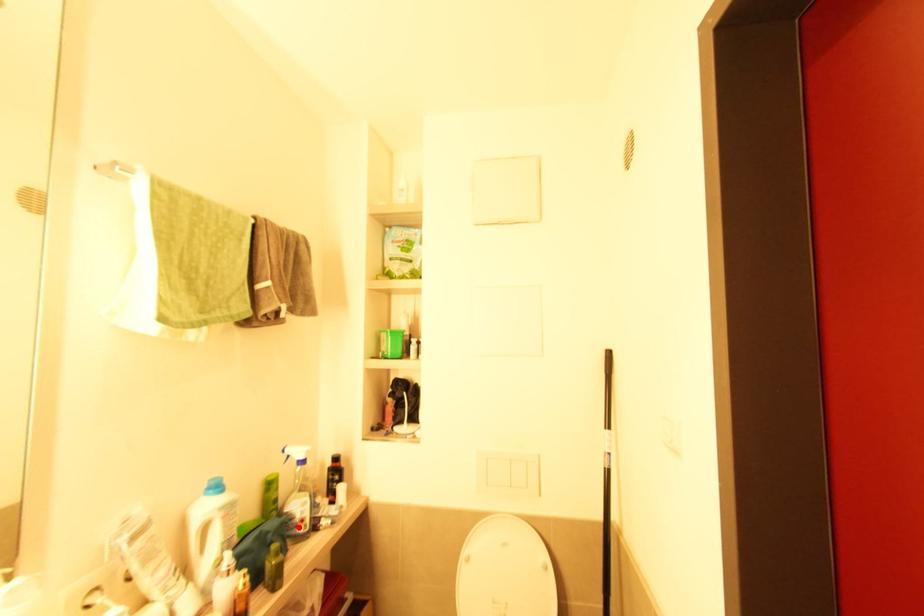
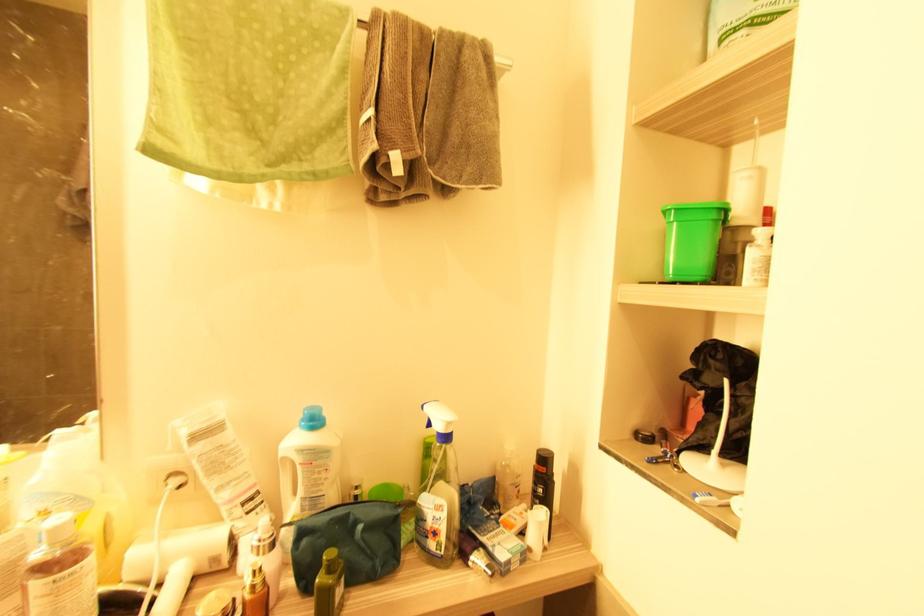
Question: I am providing you with two images of the same scene from different viewpoints. A red point is marked on the first image. Can you still see the location of the red point in image 2?

Choices:
 (A) Yes
 (B) No

Answer: (A)